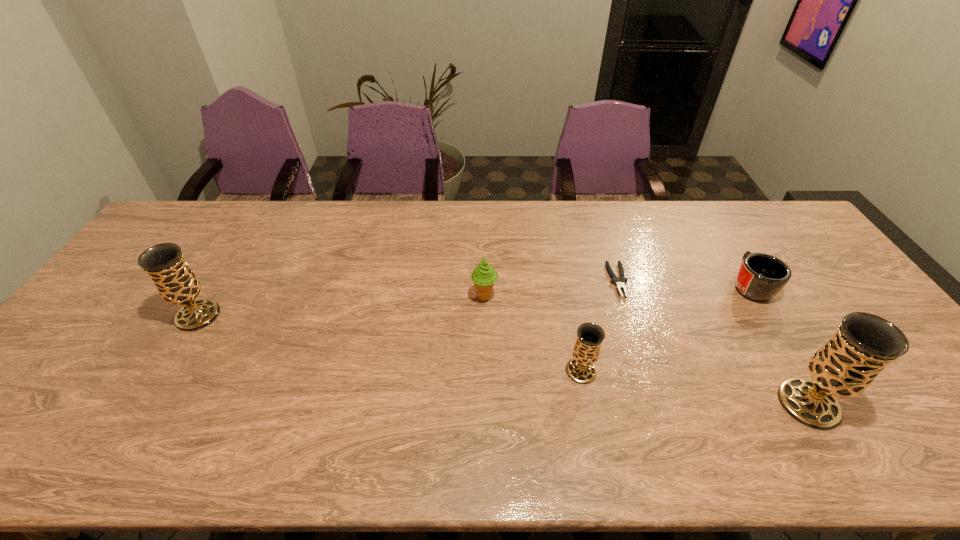
Find the location of a particular element. the farthest chalice is located at coordinates (176, 283).

This screenshot has width=960, height=540. What are the coordinates of `the leftmost object` in the screenshot? It's located at (176, 283).

The image size is (960, 540). I want to click on the second chalice from right to left, so click(581, 369).

The image size is (960, 540). Find the location of `the shortest chalice`. the shortest chalice is located at coordinates (581, 369).

What are the coordinates of `the rightmost chalice` in the screenshot? It's located at (864, 344).

Identify the location of icecream. The height and width of the screenshot is (540, 960). (484, 276).

Image resolution: width=960 pixels, height=540 pixels. Identify the location of the shortest object. (620, 283).

You are a GUI agent. You are given a task and a screenshot of the screen. Output one action in this format:
    pyautogui.click(x=<x>, y=<y>)
    Task: Click on the fourth object from left to right
    Image resolution: width=960 pixels, height=540 pixels.
    Given the screenshot: What is the action you would take?
    pyautogui.click(x=620, y=283)

The image size is (960, 540). Find the location of `mug`. mug is located at coordinates (761, 276).

Locate an element on the screen. This screenshot has height=540, width=960. free space located 0.140m on the back of the leftmost object is located at coordinates (228, 268).